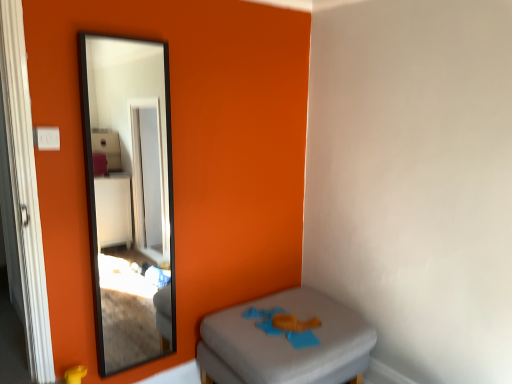
Describe the element at coordinates (285, 343) in the screenshot. I see `gray fabric ottoman at lower right` at that location.

Where is `gray fabric ottoman at lower right`? The image size is (512, 384). gray fabric ottoman at lower right is located at coordinates (285, 343).

Measure the distance between point [101,53] and camera.

Point [101,53] is 4.64 meters away from camera.

What are the coordinates of `black glass mirror at upper left` in the screenshot? It's located at (129, 196).

Describe the element at coordinates (129, 196) in the screenshot. I see `black glass mirror at upper left` at that location.

Identify the location of gray fabric ottoman at lower right. (285, 343).

Based on their positions, is black glass mirror at upper left located to the left or right of gray fabric ottoman at lower right?

From the image, it's evident that black glass mirror at upper left is to the left of gray fabric ottoman at lower right.

Is black glass mirror at upper left positioned behind gray fabric ottoman at lower right?

That is False.

Which is closer, (x=156, y=271) or (x=336, y=313)?

The point (x=336, y=313) is closer.

From the image's perspective, which is below, black glass mirror at upper left or gray fabric ottoman at lower right?

gray fabric ottoman at lower right, from the image's perspective.

From a real-world perspective, is black glass mirror at upper left on gray fabric ottoman at lower right?

Yes.

Is black glass mirror at upper left wider or thinner than gray fabric ottoman at lower right?

Clearly, black glass mirror at upper left has less width compared to gray fabric ottoman at lower right.

Who is shorter, black glass mirror at upper left or gray fabric ottoman at lower right?

With less height is gray fabric ottoman at lower right.

From the picture: Is black glass mirror at upper left bigger than gray fabric ottoman at lower right?

Actually, black glass mirror at upper left might be smaller than gray fabric ottoman at lower right.

Could gray fabric ottoman at lower right be considered to be inside black glass mirror at upper left?

That's incorrect, gray fabric ottoman at lower right is not inside black glass mirror at upper left.

Is black glass mirror at upper left far away from gray fabric ottoman at lower right?

Yes, black glass mirror at upper left and gray fabric ottoman at lower right are quite far apart.

Is black glass mirror at upper left facing away from gray fabric ottoman at lower right?

No, gray fabric ottoman at lower right is not at the back of black glass mirror at upper left.

Measure the distance between black glass mirror at upper left and gray fabric ottoman at lower right.

A distance of 1.46 meters exists between black glass mirror at upper left and gray fabric ottoman at lower right.

In order to click on mirror that appears above the gray fabric ottoman at lower right (from the image's perspective) in this screenshot , I will do `click(129, 196)`.

Which object is positioned more to the right, gray fabric ottoman at lower right or black glass mirror at upper left?

gray fabric ottoman at lower right is more to the right.

Which object is more forward, gray fabric ottoman at lower right or black glass mirror at upper left?

black glass mirror at upper left is in front.

Is point (274, 336) positioned behind point (168, 168)?

No, (274, 336) is in front of (168, 168).

From the picture: From the image's perspective, who appears lower, gray fabric ottoman at lower right or black glass mirror at upper left?

gray fabric ottoman at lower right is shown below in the image.

From a real-world perspective, is gray fabric ottoman at lower right under black glass mirror at upper left?

Yes.

Between gray fabric ottoman at lower right and black glass mirror at upper left, which one has smaller width?

black glass mirror at upper left is thinner.

Is gray fabric ottoman at lower right taller than black glass mirror at upper left?

No.

Consider the image. In terms of size, does gray fabric ottoman at lower right appear bigger or smaller than black glass mirror at upper left?

Considering their sizes, gray fabric ottoman at lower right takes up more space than black glass mirror at upper left.

Would you say gray fabric ottoman at lower right contains black glass mirror at upper left?

No.

Is the surface of gray fabric ottoman at lower right in direct contact with black glass mirror at upper left?

No, gray fabric ottoman at lower right is not touching black glass mirror at upper left.

Is gray fabric ottoman at lower right facing away from black glass mirror at upper left?

No.

Measure the distance between gray fabric ottoman at lower right and black glass mirror at upper left.

gray fabric ottoman at lower right and black glass mirror at upper left are 1.46 meters apart from each other.

Find the location of a particular element. The height and width of the screenshot is (384, 512). mirror that appears in front of the gray fabric ottoman at lower right is located at coordinates (129, 196).

Locate an element on the screen. The image size is (512, 384). furniture that appears below the black glass mirror at upper left (from a real-world perspective) is located at coordinates (285, 343).

The image size is (512, 384). What are the coordinates of `furniture behind the black glass mirror at upper left` in the screenshot? It's located at (285, 343).